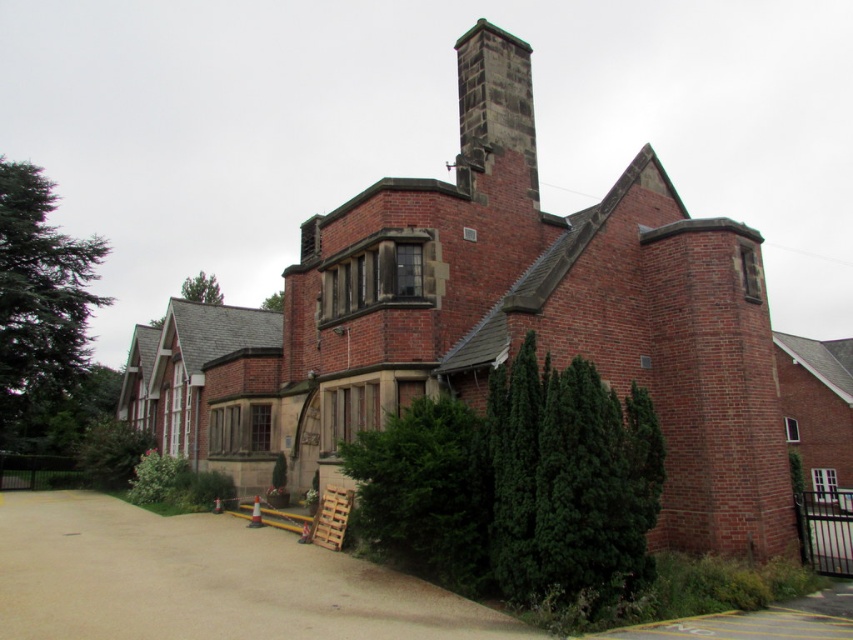
Question: Which point appears closest to the camera in this image?

Choices:
 (A) (323, 484)
 (B) (323, 596)
 (C) (486, 33)

Answer: (B)

Question: Can you confirm if brown gravel driveway at lower left is positioned above dark gray stone chimney at upper center?

Choices:
 (A) no
 (B) yes

Answer: (A)

Question: Which point is closer to the camera taking this photo?

Choices:
 (A) (535, 166)
 (B) (320, 614)
 (C) (480, 195)

Answer: (B)

Question: Which object is farther from the camera taking this photo?

Choices:
 (A) brown gravel driveway at lower left
 (B) dark gray stone chimney at upper center

Answer: (B)

Question: Is red brick church at center bigger than brown gravel driveway at lower left?

Choices:
 (A) no
 (B) yes

Answer: (B)

Question: Can you confirm if brown gravel driveway at lower left is bigger than dark gray stone chimney at upper center?

Choices:
 (A) yes
 (B) no

Answer: (A)